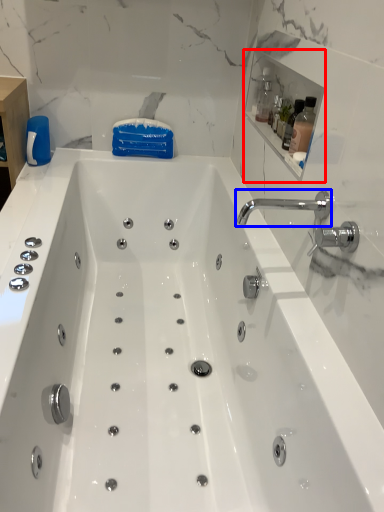
Question: Which of the following is the farthest to the observer, medicine cabinet (highlighted by a red box) or tap (highlighted by a blue box)?

Choices:
 (A) medicine cabinet
 (B) tap

Answer: (A)